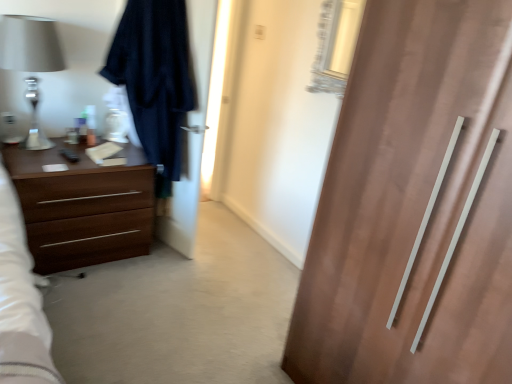
This screenshot has width=512, height=384. I want to click on vacant area on top of matte silver lamp at left (from a real-world perspective), so click(24, 18).